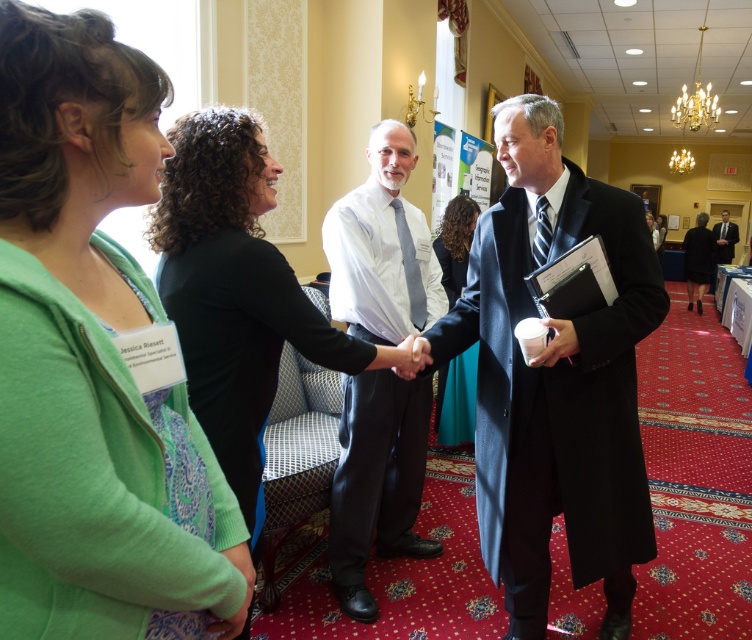
Question: Is white shirt at center wider than teal satin dress at center?

Choices:
 (A) no
 (B) yes

Answer: (B)

Question: Does black jersey at center lie in front of black wool suit at right?

Choices:
 (A) no
 (B) yes

Answer: (B)

Question: Which object is the closest to the black wool suit at right?

Choices:
 (A) black jersey at center
 (B) green fabric cardigan at upper left
 (C) dark blue suit at center

Answer: (C)

Question: Which object is closer to the camera taking this photo?

Choices:
 (A) green fabric cardigan at upper left
 (B) dark blue suit at center
 (C) dark suit at right
 (D) teal satin dress at center

Answer: (A)

Question: In this image, where is white shirt at center located relative to dark suit at right?

Choices:
 (A) above
 (B) below

Answer: (B)

Question: Which point appears farthest from the camera in this image?

Choices:
 (A) (190, 404)
 (B) (456, 240)
 (C) (393, 310)
 (D) (619, 493)

Answer: (B)